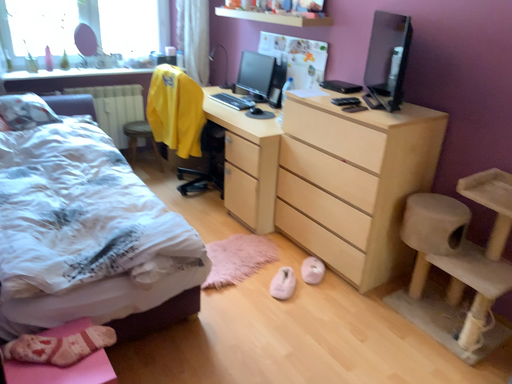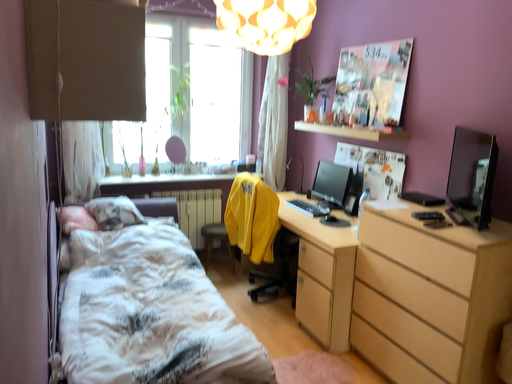
Question: Which way did the camera rotate in the video?

Choices:
 (A) rotated downward
 (B) rotated upward

Answer: (B)